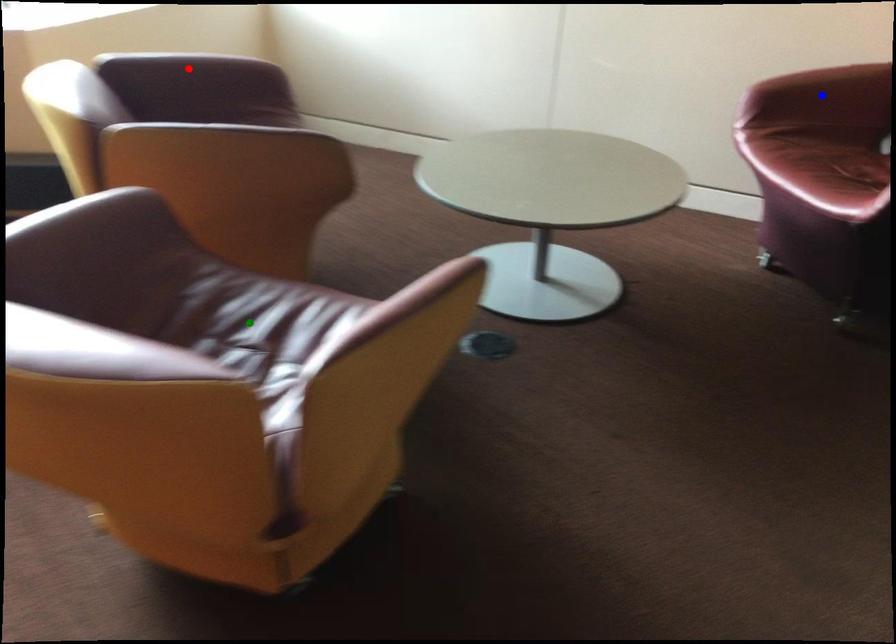
Order these from nearest to farthest:
1. blue point
2. green point
3. red point

1. green point
2. red point
3. blue point